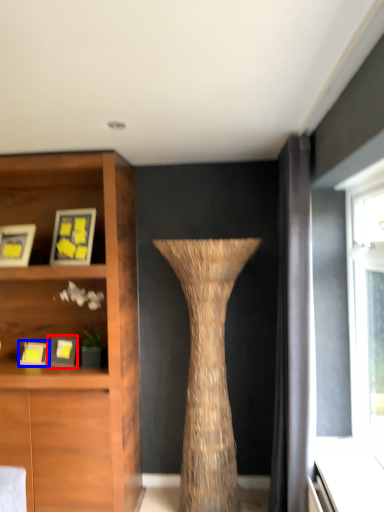
Question: Among these objects, which one is nearest to the camera, picture frame (highlighted by a red box) or picture frame (highlighted by a blue box)?

Choices:
 (A) picture frame
 (B) picture frame

Answer: (A)